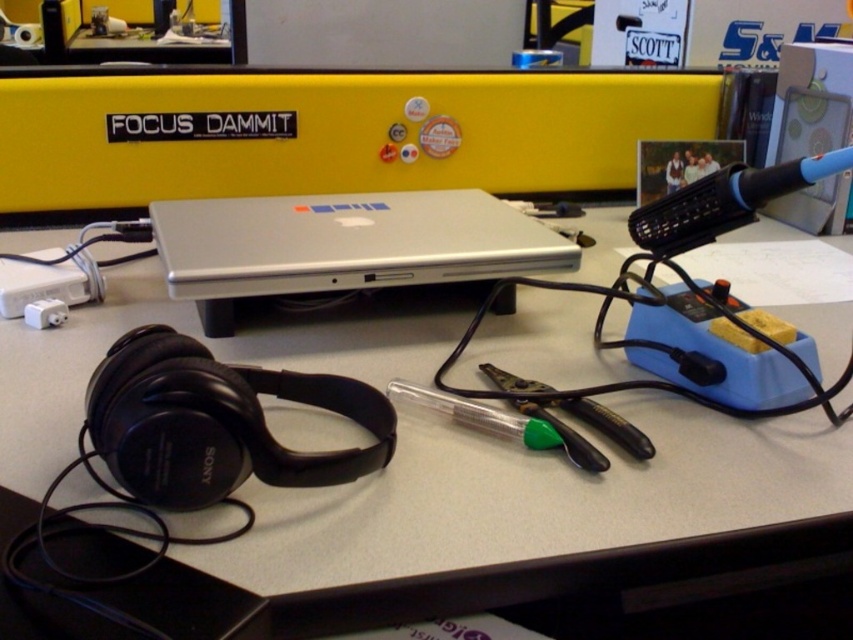
Which is more to the right, white plastic computer desk at center or silver metallic laptop at center?

From the viewer's perspective, white plastic computer desk at center appears more on the right side.

Which is behind, point (413, 600) or point (337, 282)?

The point (337, 282) is more distant.

Describe the element at coordinates (534, 520) in the screenshot. I see `white plastic computer desk at center` at that location.

The height and width of the screenshot is (640, 853). Find the location of `white plastic computer desk at center`. white plastic computer desk at center is located at coordinates (534, 520).